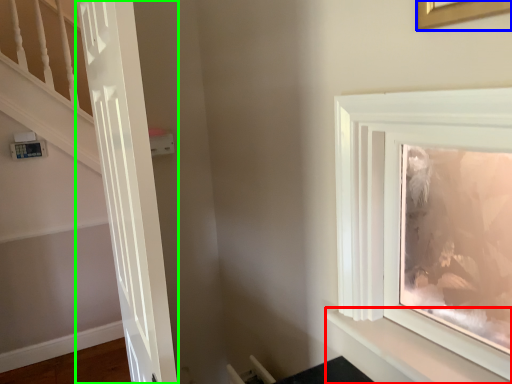
Question: Which object is the farthest from shelf (highlighted by a red box)? Choose among these: picture frame (highlighted by a blue box) or door (highlighted by a green box).

Choices:
 (A) picture frame
 (B) door

Answer: (A)